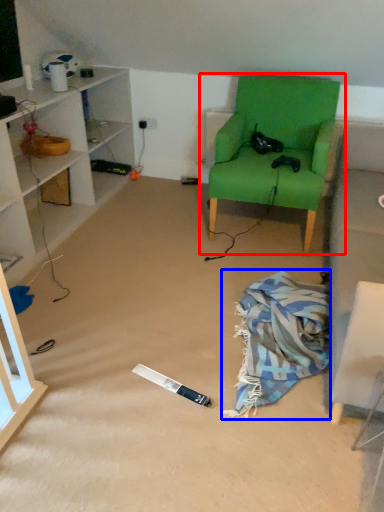
Question: Which object appears closest to the camera in this image, chair (highlighted by a red box) or blanket (highlighted by a blue box)?

Choices:
 (A) chair
 (B) blanket

Answer: (B)